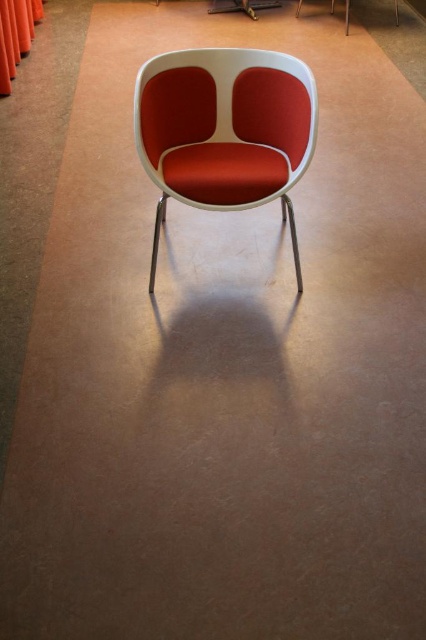
Question: Can you confirm if matte red fabric chair at center is thinner than orange fabric curtain at left?

Choices:
 (A) yes
 (B) no

Answer: (B)

Question: Which point appears farthest from the camera in this image?

Choices:
 (A) (6, 33)
 (B) (235, 180)

Answer: (A)

Question: Which object appears farthest from the camera in this image?

Choices:
 (A) orange fabric curtain at left
 (B) matte red fabric chair at center

Answer: (A)

Question: Is matte red fabric chair at center above orange fabric curtain at left?

Choices:
 (A) no
 (B) yes

Answer: (A)

Question: Observing the image, what is the correct spatial positioning of matte red fabric chair at center in reference to orange fabric curtain at left?

Choices:
 (A) above
 (B) below

Answer: (B)